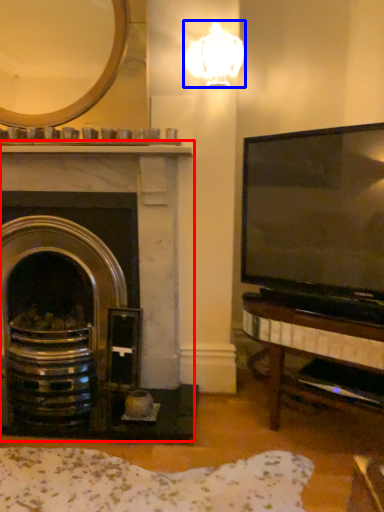
Question: Among these objects, which one is nearest to the camera, fireplace (highlighted by a red box) or lamp (highlighted by a blue box)?

Choices:
 (A) fireplace
 (B) lamp

Answer: (B)